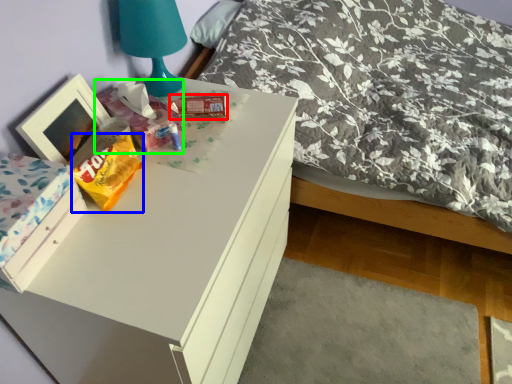
Question: Which is farther away from package (highlighted by a red box)? stuff (highlighted by a blue box) or package (highlighted by a green box)?

Choices:
 (A) stuff
 (B) package

Answer: (A)